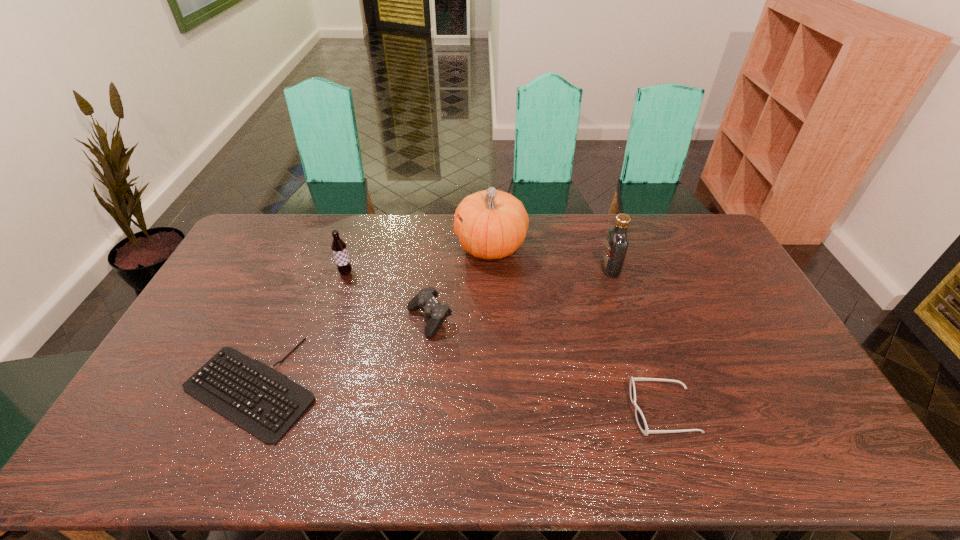
The image size is (960, 540). I want to click on pumpkin, so click(x=495, y=223).

Find the location of a particular element. vodka is located at coordinates (617, 242).

You are a GUI agent. You are given a task and a screenshot of the screen. Output one action in this format:
    pyautogui.click(x=<x>, y=<y>)
    Task: Click on the third tallest object
    Image resolution: width=960 pixels, height=540 pixels.
    Given the screenshot: What is the action you would take?
    pyautogui.click(x=339, y=249)

Where is `control`? The width and height of the screenshot is (960, 540). control is located at coordinates (425, 300).

Identify the location of the second shortest object. Image resolution: width=960 pixels, height=540 pixels. (640, 418).

At what (x,y) coordinates should I click in order to perform the action: click on the shortest object. Please return your answer as a coordinate pair (x, y). Looking at the image, I should click on (264, 402).

This screenshot has width=960, height=540. Identify the location of free space located 0.050m on the front-facing side of the pumpkin. (442, 247).

Locate an element on the screen. The width and height of the screenshot is (960, 540). vacant space situated 0.350m on the front-facing side of the pumpkin is located at coordinates (362, 247).

Identify the location of free space located on the front-facing side of the pumpkin. (389, 247).

Locate an element on the screen. vacant space positioned on the front-facing side of the vodka is located at coordinates (497, 268).